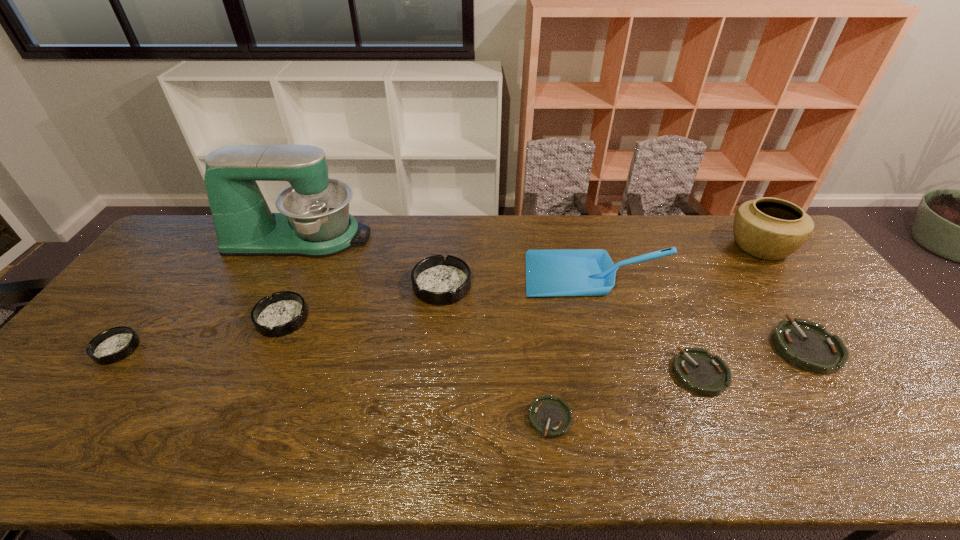
Image resolution: width=960 pixels, height=540 pixels. Find the location of `vacant space situated 0.080m on the right of the rightmost ashtray`. vacant space situated 0.080m on the right of the rightmost ashtray is located at coordinates (867, 347).

Find the location of a particular element. blank space located 0.210m on the back of the leftmost ashtray is located at coordinates (169, 282).

Image resolution: width=960 pixels, height=540 pixels. In order to click on free space located on the front of the second green ashtray from left to right in this screenshot , I will do `click(722, 423)`.

What are the coordinates of `vacant region located on the left of the smallest green ashtray` in the screenshot? It's located at (438, 418).

Find the location of `mixer at the far edge`. mixer at the far edge is located at coordinates (314, 221).

Find the location of `pottery that is at the far edge`. pottery that is at the far edge is located at coordinates (768, 228).

Where is `dustpan that is positioned at the far edge`? dustpan that is positioned at the far edge is located at coordinates (570, 272).

Identify the location of object located in the near edge section of the desktop. (551, 417).

You are a GUI agent. You are given a task and a screenshot of the screen. Output one action in this format:
    pyautogui.click(x=<x>, y=<y>)
    Task: Click on the object present at the left edge
    This screenshot has width=960, height=540.
    Given the screenshot: What is the action you would take?
    pyautogui.click(x=115, y=344)

Find the location of a particular element. This screenshot has height=540, width=960. pottery situated at the right edge is located at coordinates (768, 228).